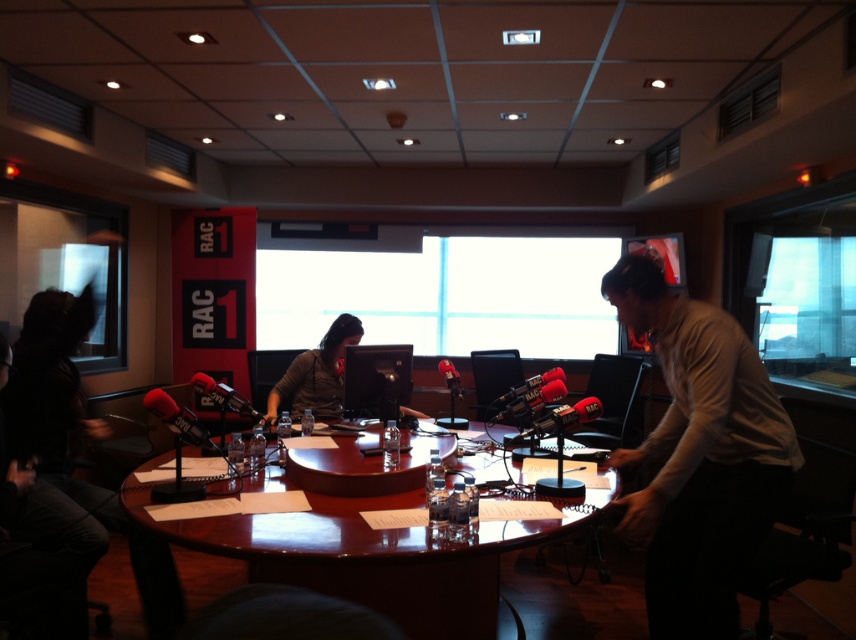
Can you confirm if white shirt at center is thinner than shiny wooden table at center?

Yes, white shirt at center is thinner than shiny wooden table at center.

Does white shirt at center have a larger size compared to shiny wooden table at center?

Actually, white shirt at center might be smaller than shiny wooden table at center.

Locate an element on the screen. white shirt at center is located at coordinates (700, 456).

Does white shirt at center appear over matte black monitor at center?

No, white shirt at center is not above matte black monitor at center.

Between white shirt at center and matte black monitor at center, which one has less height?

matte black monitor at center

Measure the distance between white shirt at center and camera.

white shirt at center is 6.62 feet from camera.

Identify the location of white shirt at center. The height and width of the screenshot is (640, 856). (700, 456).

From the picture: Is shiny wooden table at center below matte black monitor at center?

Yes.

Is shiny wooden table at center to the left of matte black monitor at center from the viewer's perspective?

Incorrect, shiny wooden table at center is not on the left side of matte black monitor at center.

Between point (288, 528) and point (337, 410), which one is positioned behind?

The point (337, 410) is behind.

Locate an element on the screen. The height and width of the screenshot is (640, 856). shiny wooden table at center is located at coordinates (367, 557).